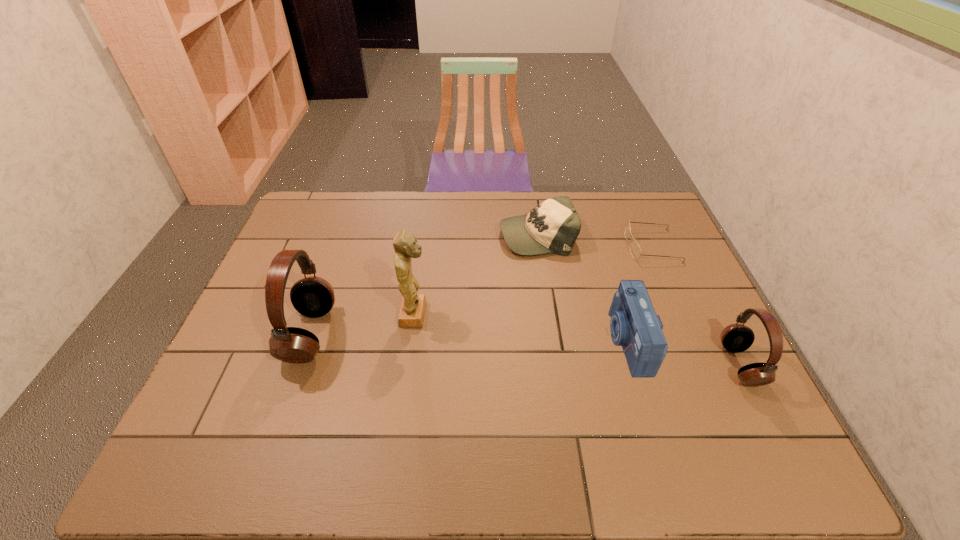
The height and width of the screenshot is (540, 960). What are the coordinates of `object present at the far right corner` in the screenshot? It's located at (635, 250).

The width and height of the screenshot is (960, 540). Identify the location of object that is at the near right corner. (736, 337).

Find the location of a particular element. The width and height of the screenshot is (960, 540). free region at the far edge is located at coordinates (519, 201).

You are a GUI agent. You are given a task and a screenshot of the screen. Output one action in this format:
    pyautogui.click(x=<x>, y=<y>)
    Task: Click on the vacant space at the near edge
    The image size is (960, 540).
    Given the screenshot: What is the action you would take?
    pyautogui.click(x=550, y=417)

The height and width of the screenshot is (540, 960). I want to click on vacant space at the left edge of the desktop, so click(x=232, y=341).

You are a GUI agent. You are given a task and a screenshot of the screen. Output one action in this format:
    pyautogui.click(x=<x>, y=<y>)
    Task: Click on the vacant space at the right edge of the desktop
    
    Given the screenshot: What is the action you would take?
    pyautogui.click(x=677, y=295)

Image resolution: width=960 pixels, height=540 pixels. In the image, there is a desktop. In order to click on free space at the far left corner in this screenshot , I will do `click(341, 215)`.

Image resolution: width=960 pixels, height=540 pixels. I want to click on vacant region at the far right corner of the desktop, so click(639, 197).

Find the location of a particular element. The image size is (960, 540). vacant space at the near right corner of the desktop is located at coordinates (737, 409).

The height and width of the screenshot is (540, 960). Identify the location of unoccupied position between the leftmost object and the shorter headset. (525, 349).